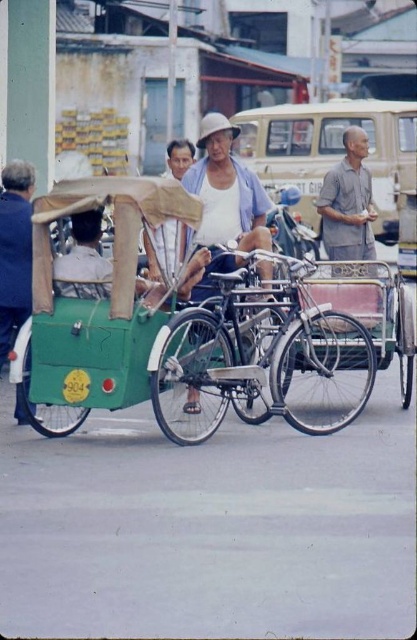
You are a delivery person who needs to load a package onto the silver metallic bicycle at center and the gray cotton shirt at center. Which object is taller and can accommodate a taller package?

The silver metallic bicycle at center is taller than the gray cotton shirt at center, so it can accommodate a taller package.

You are a photographer trying to capture a clear photo of the blue fabric shirt at left and the gray cotton shirt at center. Which one will be more visible in your photo?

The gray cotton shirt at center will be more visible in the photo because the blue fabric shirt at left is behind it.